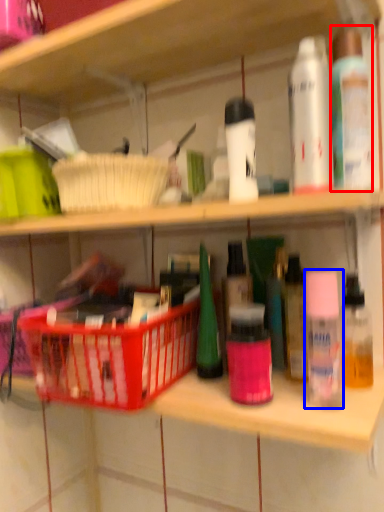
Question: Which object appears farthest to the camera in this image, toiletry (highlighted by a red box) or toiletry (highlighted by a blue box)?

Choices:
 (A) toiletry
 (B) toiletry

Answer: (A)